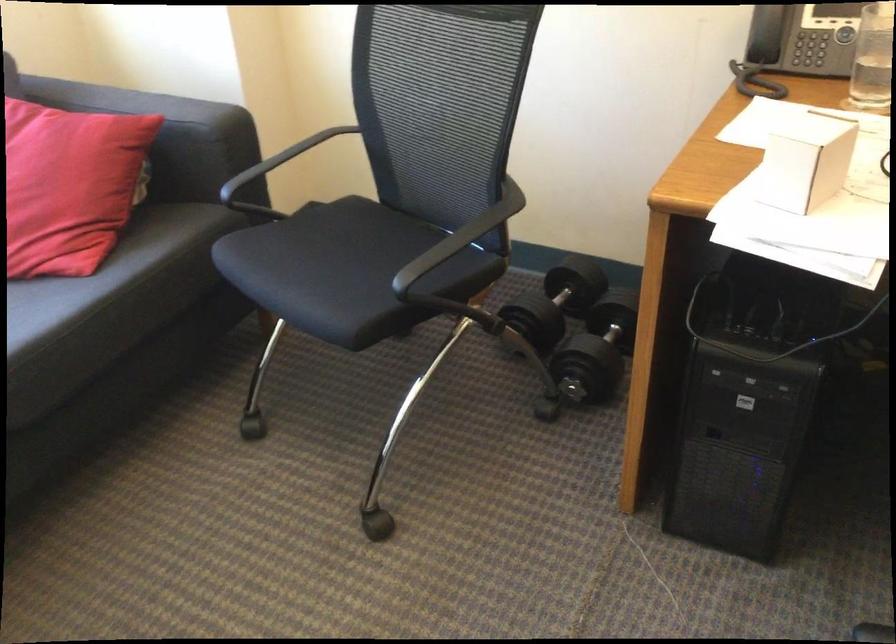
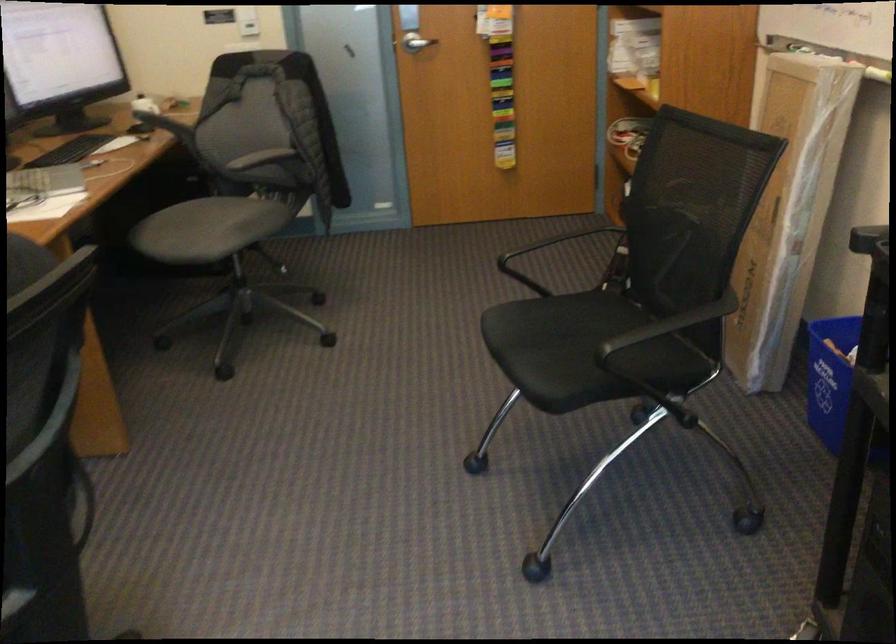
Based on the continuous images, in which direction is the camera rotating?

The camera rotated toward right-down.